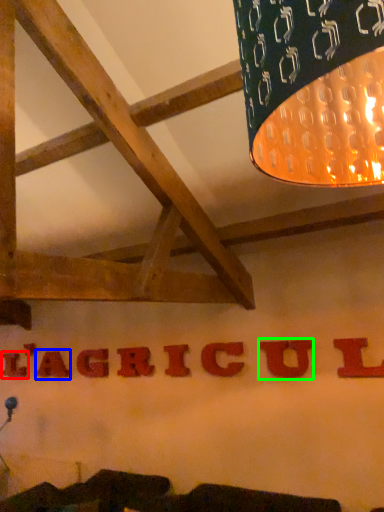
Question: Considering the real-world distances, which object is closest to letter (highlighted by a red box)? letter (highlighted by a blue box) or letter (highlighted by a green box).

Choices:
 (A) letter
 (B) letter

Answer: (A)